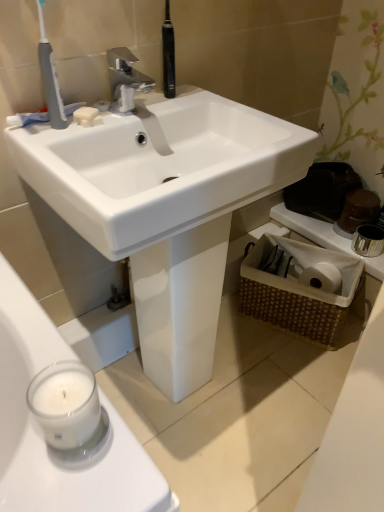
Question: Considering the relative sizes of white glossy sink at center and silver metallic faucet at upper center in the image provided, is white glossy sink at center wider than silver metallic faucet at upper center?

Choices:
 (A) no
 (B) yes

Answer: (B)

Question: Is white glossy sink at center to the right of silver metallic faucet at upper center from the viewer's perspective?

Choices:
 (A) no
 (B) yes

Answer: (B)

Question: Is white glossy sink at center taller than silver metallic faucet at upper center?

Choices:
 (A) yes
 (B) no

Answer: (A)

Question: Is white glossy sink at center outside silver metallic faucet at upper center?

Choices:
 (A) yes
 (B) no

Answer: (A)

Question: Is white glossy sink at center turned away from silver metallic faucet at upper center?

Choices:
 (A) yes
 (B) no

Answer: (B)

Question: From a real-world perspective, relative to white matte toothpaste at upper left, is woven brown basket at lower right vertically above or below?

Choices:
 (A) below
 (B) above

Answer: (A)

Question: Which is correct: woven brown basket at lower right is inside white matte toothpaste at upper left, or outside of it?

Choices:
 (A) inside
 (B) outside

Answer: (B)

Question: Is point (291, 309) positioned closer to the camera than point (66, 108)?

Choices:
 (A) closer
 (B) farther

Answer: (B)

Question: In the image, is woven brown basket at lower right positioned in front of or behind white matte toothpaste at upper left?

Choices:
 (A) behind
 (B) front

Answer: (A)

Question: Based on their sizes in the image, would you say white matte soap at upper left is bigger or smaller than white matte toothpaste at upper left?

Choices:
 (A) big
 (B) small

Answer: (B)

Question: Do you think white matte soap at upper left is within white matte toothpaste at upper left, or outside of it?

Choices:
 (A) inside
 (B) outside

Answer: (B)

Question: Is white matte soap at upper left taller or shorter than white matte toothpaste at upper left?

Choices:
 (A) tall
 (B) short

Answer: (B)

Question: Does point (89, 110) appear closer or farther from the camera than point (34, 119)?

Choices:
 (A) closer
 (B) farther

Answer: (B)

Question: Considering their positions, is gray plastic toothbrush at upper left located in front of or behind white matte toothpaste at upper left?

Choices:
 (A) behind
 (B) front

Answer: (B)

Question: Is gray plastic toothbrush at upper left inside or outside of white matte toothpaste at upper left?

Choices:
 (A) inside
 (B) outside

Answer: (B)